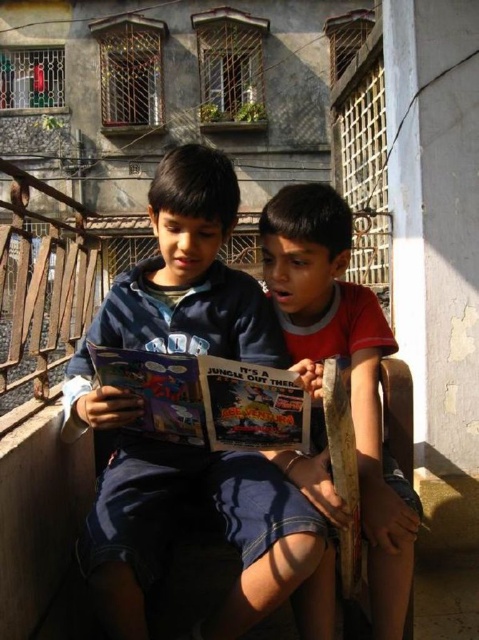
Does blue cotton shirt at center appear on the right side of matte red shirt at center?

No, blue cotton shirt at center is not to the right of matte red shirt at center.

Who is more distant from viewer, (324, 545) or (321, 193)?

Point (321, 193)

I want to click on blue cotton shirt at center, so click(216, 512).

Where is `matte red shirt at center`? The width and height of the screenshot is (479, 640). matte red shirt at center is located at coordinates (344, 369).

Locate an element on the screen. The width and height of the screenshot is (479, 640). matte red shirt at center is located at coordinates (344, 369).

Is blue cotton shirt at center shorter than matte plastic comic book at center?

No.

Is blue cotton shirt at center bigger than matte plastic comic book at center?

Indeed, blue cotton shirt at center has a larger size compared to matte plastic comic book at center.

Does point (314, 586) lie behind point (235, 385)?

Yes.

The width and height of the screenshot is (479, 640). I want to click on blue cotton shirt at center, so click(x=216, y=512).